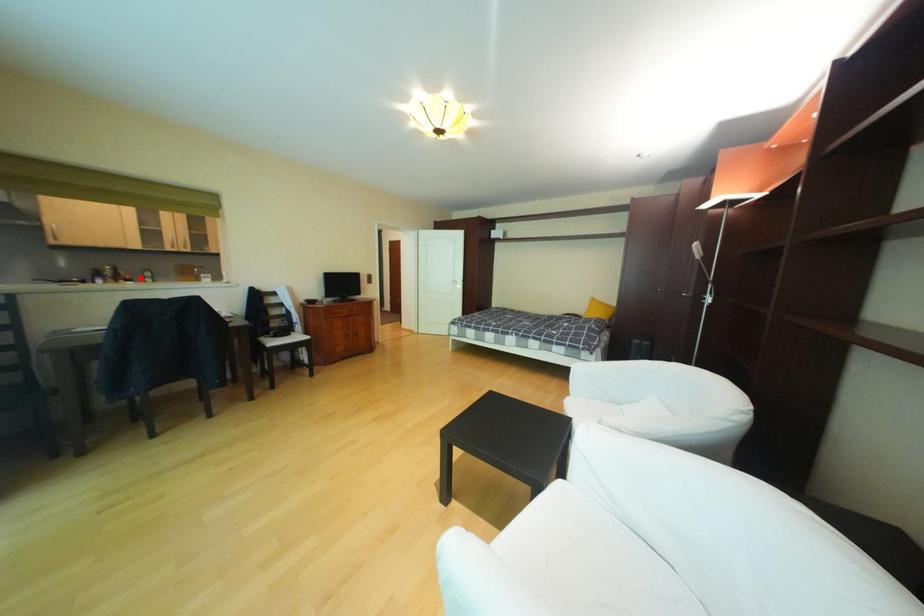
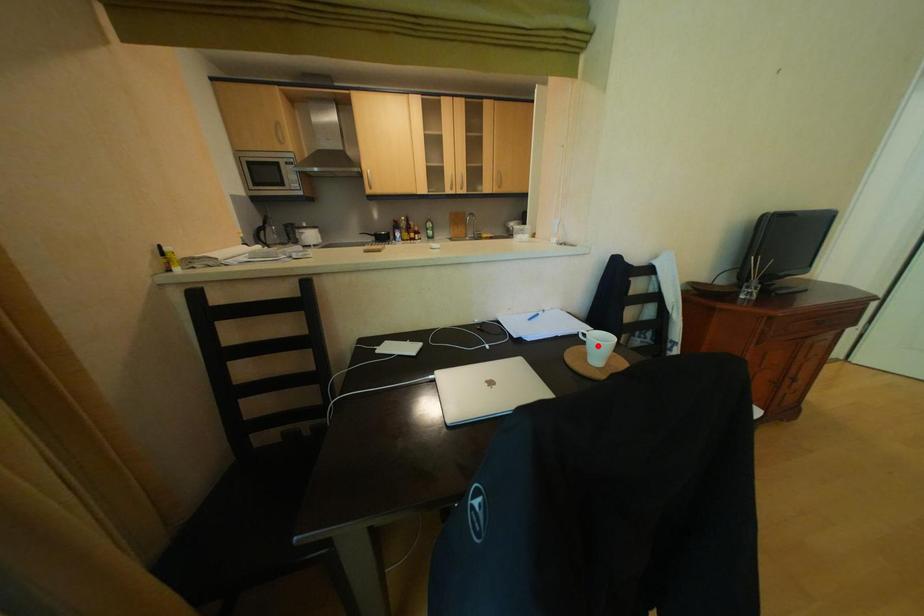
In the scene shown: I am providing you with two images of the same scene from different viewpoints. A red point is marked on the first image and another point is marked on the second image. Is the marked point in image1 the same physical position as the marked point in image2?

No